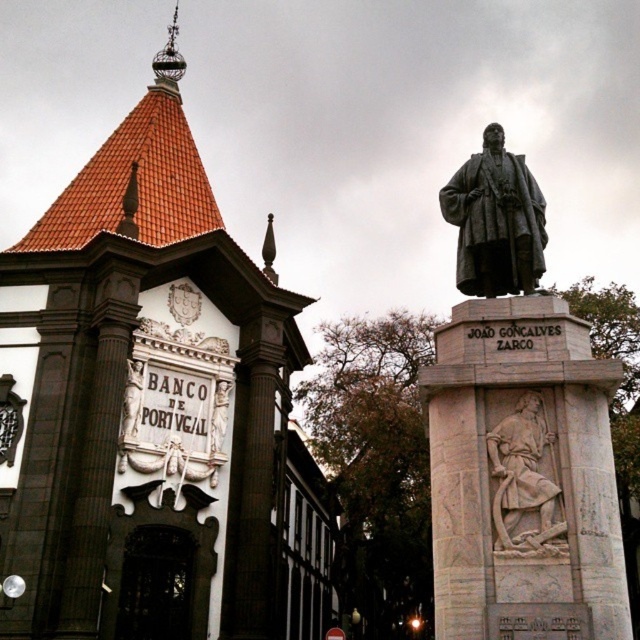
Does bronze statue at center have a lesser width compared to gray stone relief at center?

No, bronze statue at center is not thinner than gray stone relief at center.

Can you confirm if bronze statue at center is positioned above gray stone relief at center?

Yes.

This screenshot has width=640, height=640. In order to click on bronze statue at center in this screenshot , I will do `click(496, 220)`.

Can you confirm if gray stone relief at center is positioned above polished bronze statue at center?

Yes, gray stone relief at center is above polished bronze statue at center.

Who is positioned more to the left, gray stone relief at center or polished bronze statue at center?

polished bronze statue at center is more to the left.

I want to click on gray stone relief at center, so click(525, 483).

Find the location of a particular element. The width and height of the screenshot is (640, 640). gray stone relief at center is located at coordinates (525, 483).

Based on the photo, can you confirm if bronze statue at center is positioned to the right of polished bronze statue at center?

Correct, you'll find bronze statue at center to the right of polished bronze statue at center.

Between bronze statue at center and polished bronze statue at center, which one appears on the right side from the viewer's perspective?

bronze statue at center

Where is `bronze statue at center`? The image size is (640, 640). bronze statue at center is located at coordinates [496, 220].

This screenshot has width=640, height=640. In order to click on bronze statue at center in this screenshot , I will do `click(496, 220)`.